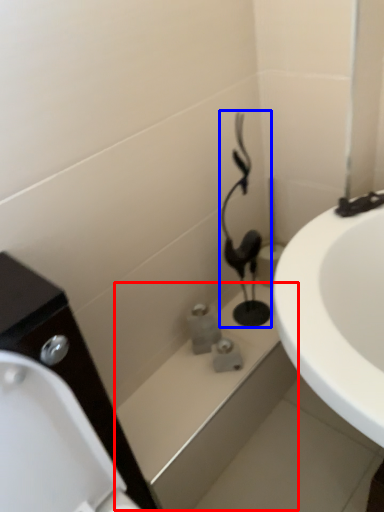
Question: Which of the following is the closest to the observer, bath (highlighted by a red box) or plumbing fixture (highlighted by a blue box)?

Choices:
 (A) bath
 (B) plumbing fixture

Answer: (B)